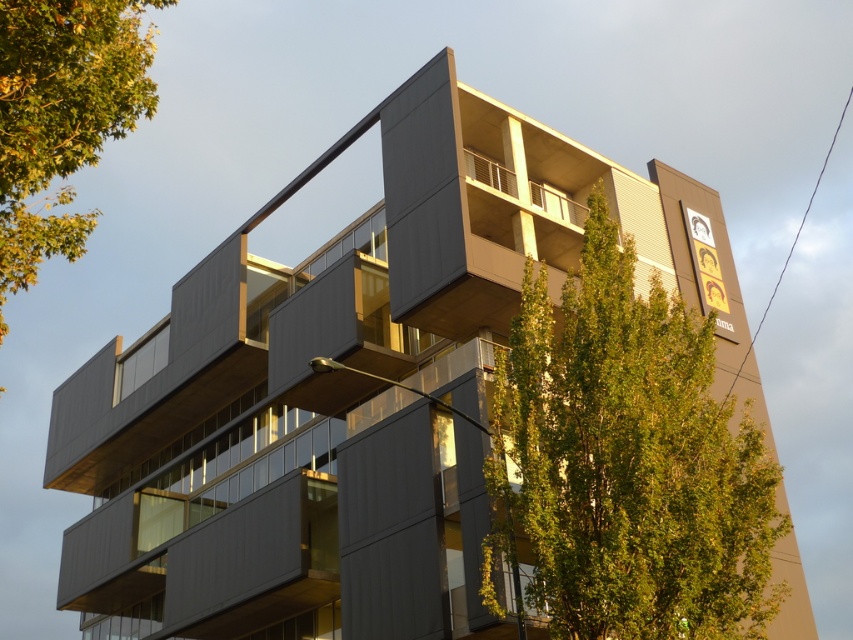
Question: Which object is closer to the camera taking this photo?

Choices:
 (A) green leafy tree at upper center
 (B) green leafy tree at upper left

Answer: (B)

Question: Does green leafy tree at upper center come in front of green leafy tree at upper left?

Choices:
 (A) no
 (B) yes

Answer: (A)

Question: Observing the image, what is the correct spatial positioning of green leafy tree at upper center in reference to green leafy tree at upper left?

Choices:
 (A) below
 (B) above

Answer: (A)

Question: Is green leafy tree at upper center below green leafy tree at upper left?

Choices:
 (A) no
 (B) yes

Answer: (B)